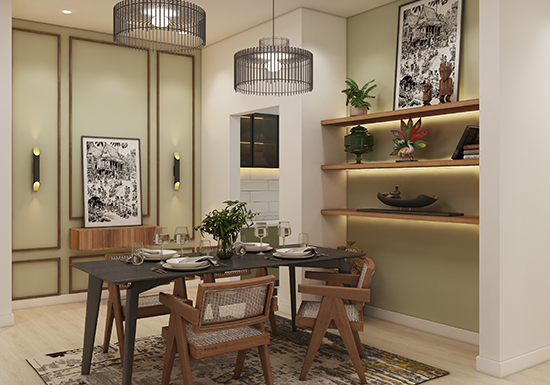
Locate an element on the screen. The height and width of the screenshot is (385, 550). paintings is located at coordinates (429, 24), (125, 179).